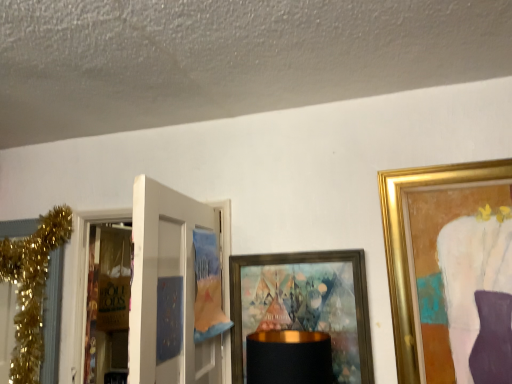
Question: Can you confirm if gold glitter garland at left is smaller than brown paper bag at left?

Choices:
 (A) no
 (B) yes

Answer: (A)

Question: Can you confirm if gold glitter garland at left is wider than brown paper bag at left?

Choices:
 (A) yes
 (B) no

Answer: (A)

Question: From the image's perspective, is gold glitter garland at left located above brown paper bag at left?

Choices:
 (A) yes
 (B) no

Answer: (A)

Question: Can we say gold glitter garland at left lies outside brown paper bag at left?

Choices:
 (A) yes
 (B) no

Answer: (A)

Question: Considering the relative positions of gold glitter garland at left and brown paper bag at left in the image provided, is gold glitter garland at left to the left of brown paper bag at left from the viewer's perspective?

Choices:
 (A) yes
 (B) no

Answer: (A)

Question: In terms of width, does gold glitter garland at left look wider or thinner when compared to white matte door at left?

Choices:
 (A) thin
 (B) wide

Answer: (B)

Question: Considering the positions of point (19, 329) and point (189, 220), is point (19, 329) closer or farther from the camera than point (189, 220)?

Choices:
 (A) farther
 (B) closer

Answer: (A)

Question: From a real-world perspective, is gold glitter garland at left physically located above or below white matte door at left?

Choices:
 (A) below
 (B) above

Answer: (B)

Question: From the image's perspective, is gold glitter garland at left positioned above or below white matte door at left?

Choices:
 (A) above
 (B) below

Answer: (B)

Question: From the image's perspective, relative to white matte door at left, is gold-framed artwork at center above or below?

Choices:
 (A) below
 (B) above

Answer: (A)

Question: From a real-world perspective, is gold-framed artwork at center positioned above or below white matte door at left?

Choices:
 (A) above
 (B) below

Answer: (B)

Question: Considering the positions of gold-framed artwork at center and white matte door at left in the image, is gold-framed artwork at center taller or shorter than white matte door at left?

Choices:
 (A) tall
 (B) short

Answer: (B)

Question: Would you say gold-framed artwork at center is inside or outside white matte door at left?

Choices:
 (A) outside
 (B) inside

Answer: (A)

Question: Is gold-framed artwork at center to the left or to the right of gold glitter garland at left in the image?

Choices:
 (A) right
 (B) left

Answer: (A)

Question: Is gold-framed artwork at center wider or thinner than gold glitter garland at left?

Choices:
 (A) wide
 (B) thin

Answer: (B)